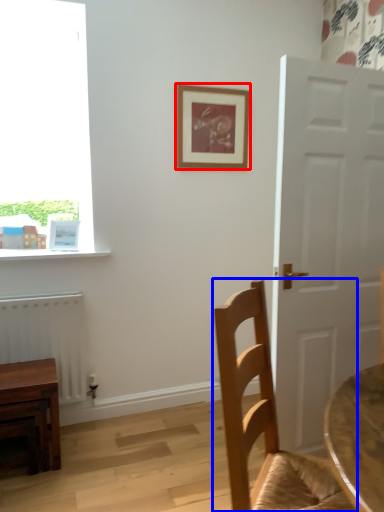
Question: Which object is further to the camera taking this photo, picture frame (highlighted by a red box) or chair (highlighted by a blue box)?

Choices:
 (A) picture frame
 (B) chair

Answer: (A)